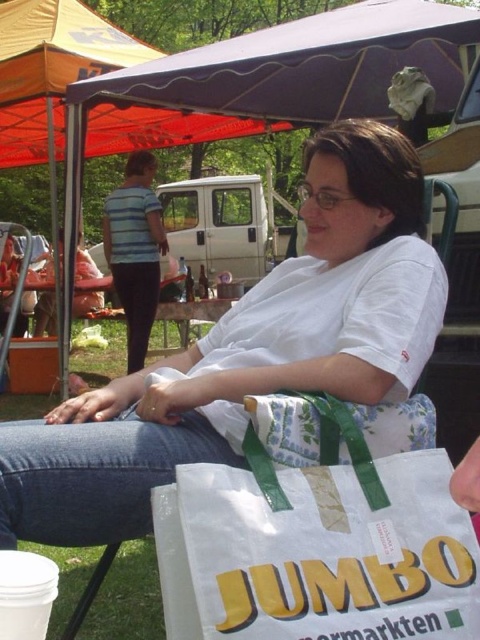
You are taking a photo of the person sitting in front of the large white shopping bag with green handles. The camera you are using has a focal length of 50mm and you want to ensure the point at coordinates point [202,545] is in focus. What is the minimum distance in inches you should be from the subject to achieve this focus?

The point at coordinates point [202,545] is 31.17 inches from the camera. To ensure this point is in focus, you should be at least 31.17 inches away from the subject.

You are standing in front of the person and want to know which of the two points, point (376, 289) or point (40, 13), is closer to you. Which one is closer?

Point (376, 289) is closer to the camera than point (40, 13), so it is closer to you.